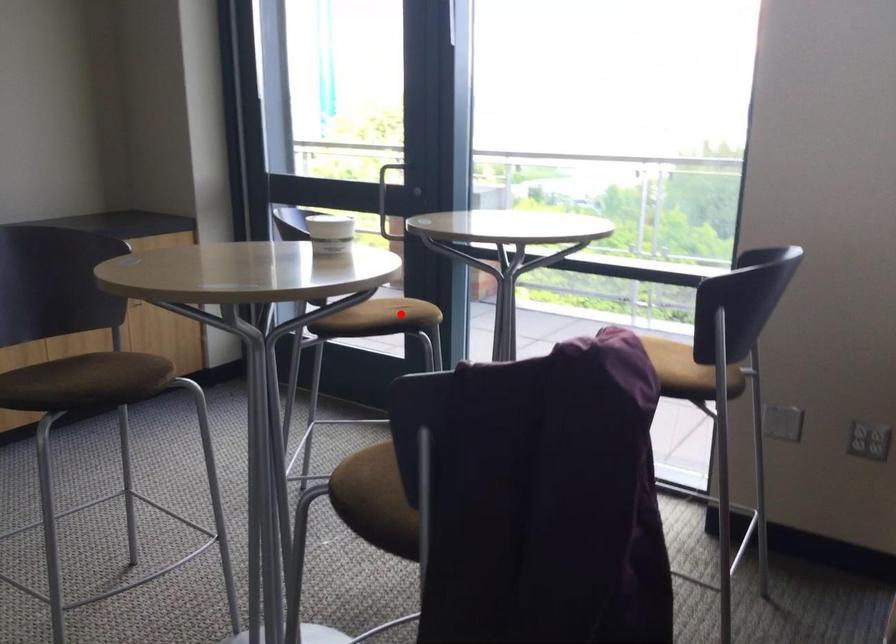
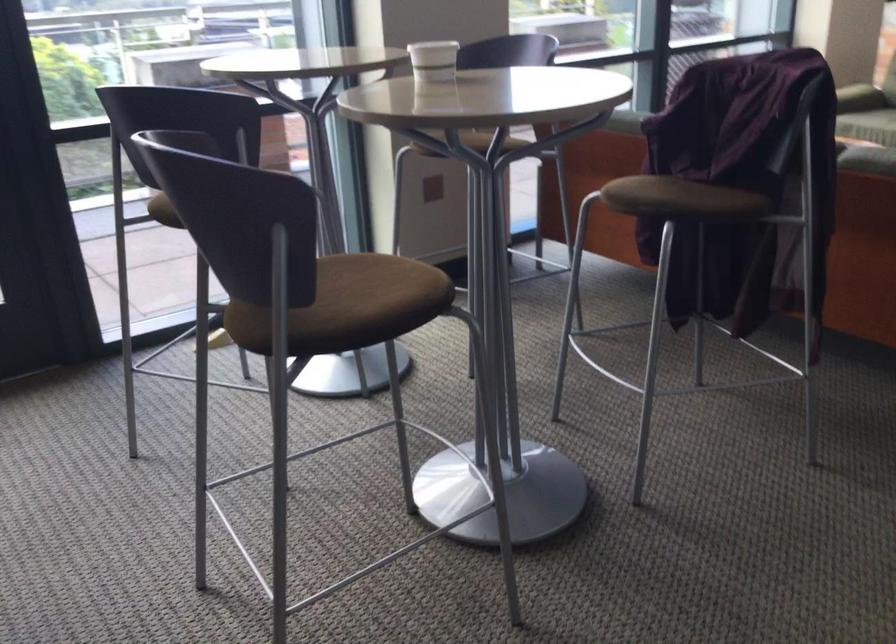
Question: I am providing you with two images of the same scene from different viewpoints. A red point is marked on the first image. Is the red point's position out of view in image 2?

Choices:
 (A) Yes
 (B) No

Answer: (A)